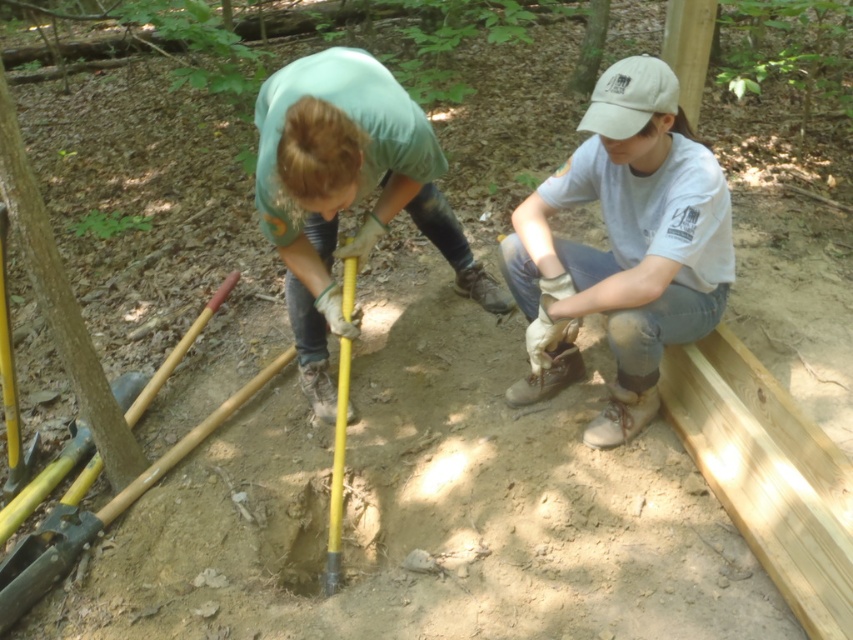
Measure the distance from white cotton cap at upper center to smooth dirt hole at center.

white cotton cap at upper center and smooth dirt hole at center are 36.54 inches apart.

Is the position of white cotton cap at upper center more distant than that of smooth dirt hole at center?

No, it is not.

You are a GUI agent. You are given a task and a screenshot of the screen. Output one action in this format:
    pyautogui.click(x=<x>, y=<y>)
    Task: Click on the white cotton cap at upper center
    This screenshot has height=640, width=853.
    Given the screenshot: What is the action you would take?
    pyautogui.click(x=624, y=248)

Which is above, smooth dirt hole at center or yellow plastic shovel at center?

yellow plastic shovel at center is higher up.

Which of these two, smooth dirt hole at center or yellow plastic shovel at center, stands taller?

yellow plastic shovel at center is taller.

Is point (349, 518) closer to viewer compared to point (341, 241)?

No, (349, 518) is behind (341, 241).

Where is `smooth dirt hole at center`? smooth dirt hole at center is located at coordinates (302, 540).

Is white cotton cap at upper center positioned in front of yellow plastic shovel at center?

Yes, white cotton cap at upper center is closer to the viewer.

Which is behind, point (660, 195) or point (339, 420)?

The point (339, 420) is more distant.

Is point (689, 291) in front of point (334, 445)?

Yes, point (689, 291) is closer to viewer.

This screenshot has height=640, width=853. I want to click on white cotton cap at upper center, so click(x=624, y=248).